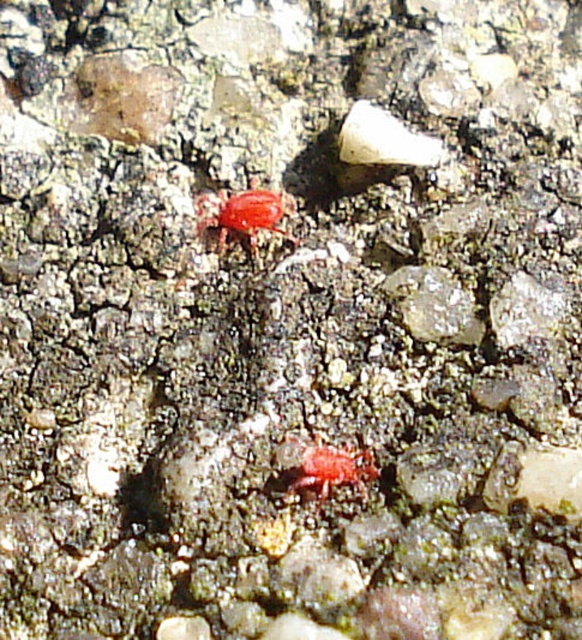
You are a researcher observing two red insects in the image. You need to collect the one closer to you first. Which one should you choose between the shiny red bug at center and the matte red insect at center?

The shiny red bug at center is closer to you than the matte red insect at center, so you should choose the shiny red bug at center first.

You are an entomologist examining the textured surface in the scene. You notice two red insects, the shiny red bug at center and the matte red insect at center. Which one is bigger?

Answer: The shiny red bug at center is larger in size compared to the matte red insect at center.